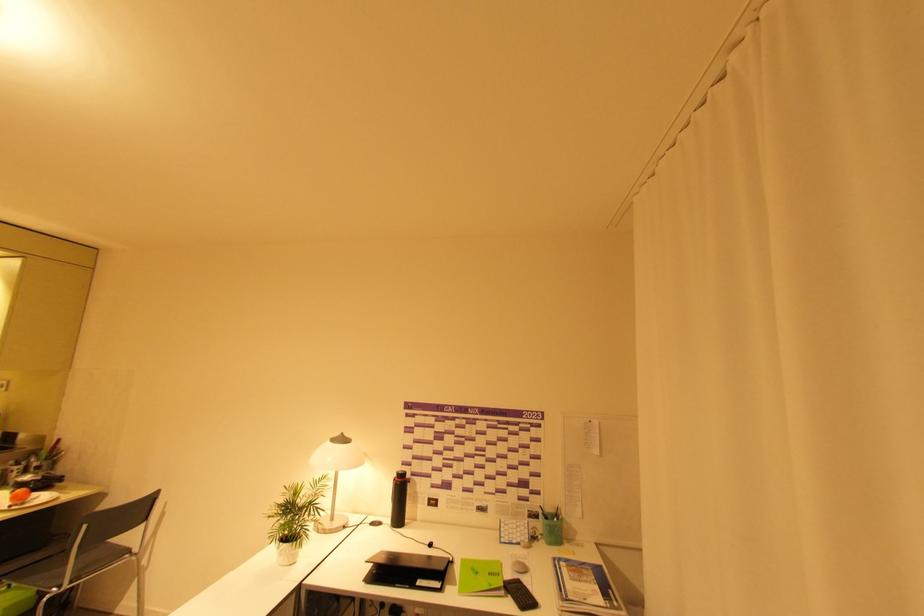
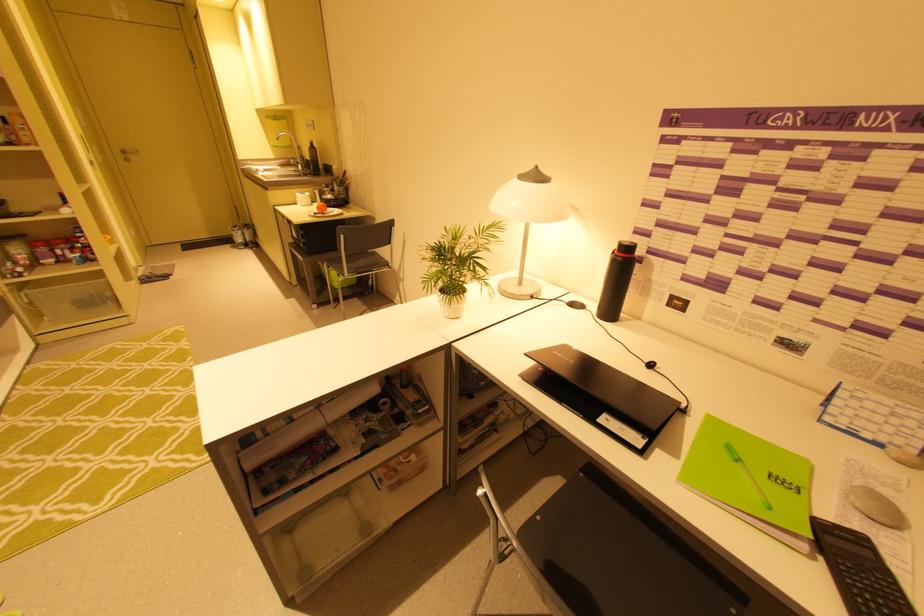
Locate, in the second image, the point that corresponds to point 292,493 in the first image.

(451, 235)